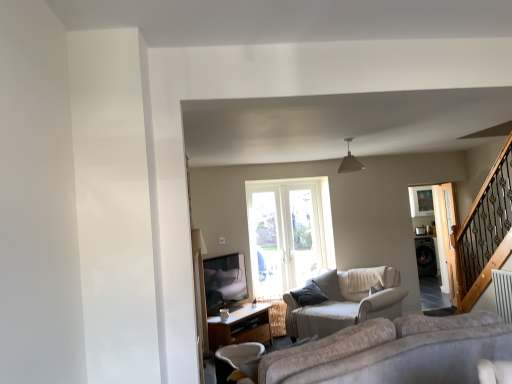
Question: From a real-world perspective, is clear glass screen door at right, the 1th screen door when ordered from back to front, positioned under black glossy washing machine at right based on gravity?

Choices:
 (A) no
 (B) yes

Answer: (A)

Question: From the image's perspective, would you say clear glass screen door at right, acting as the 2th screen door starting from the front, is positioned over black glossy washing machine at right?

Choices:
 (A) yes
 (B) no

Answer: (A)

Question: Is clear glass screen door at right, the 1th screen door when ordered from back to front, touching black glossy washing machine at right?

Choices:
 (A) yes
 (B) no

Answer: (B)

Question: Does clear glass screen door at right, the 1th screen door when ordered from back to front, have a smaller size compared to black glossy washing machine at right?

Choices:
 (A) no
 (B) yes

Answer: (B)

Question: From the image's perspective, is clear glass screen door at right, acting as the 2th screen door starting from the front, below black glossy washing machine at right?

Choices:
 (A) yes
 (B) no

Answer: (B)

Question: Can you confirm if clear glass screen door at right, acting as the 2th screen door starting from the front, is wider than black glossy washing machine at right?

Choices:
 (A) no
 (B) yes

Answer: (A)

Question: Is the depth of white fabric chair at lower center greater than that of black glossy washing machine at right?

Choices:
 (A) no
 (B) yes

Answer: (A)

Question: Can you confirm if white fabric chair at lower center is taller than black glossy washing machine at right?

Choices:
 (A) no
 (B) yes

Answer: (A)

Question: Does white fabric chair at lower center have a lesser height compared to black glossy washing machine at right?

Choices:
 (A) yes
 (B) no

Answer: (A)

Question: Is white fabric chair at lower center oriented away from black glossy washing machine at right?

Choices:
 (A) no
 (B) yes

Answer: (A)

Question: Does white fabric chair at lower center appear on the left side of black glossy washing machine at right?

Choices:
 (A) yes
 (B) no

Answer: (A)

Question: From the image's perspective, is white fabric chair at lower center below black glossy washing machine at right?

Choices:
 (A) no
 (B) yes

Answer: (B)

Question: Is black glossy washing machine at right placed right next to white fabric chair at lower center?

Choices:
 (A) yes
 (B) no

Answer: (B)